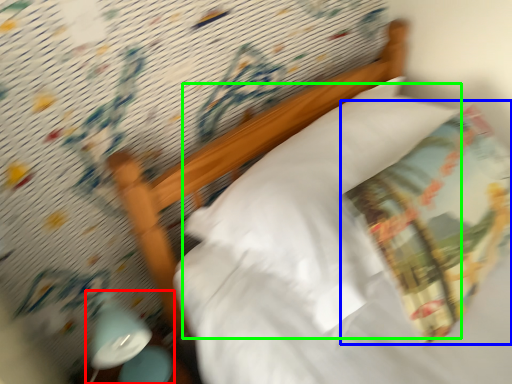
Question: Which is nearer to the bedside lamp (highlighted by a red box)? throw pillow (highlighted by a blue box) or pillow (highlighted by a green box).

Choices:
 (A) throw pillow
 (B) pillow

Answer: (B)